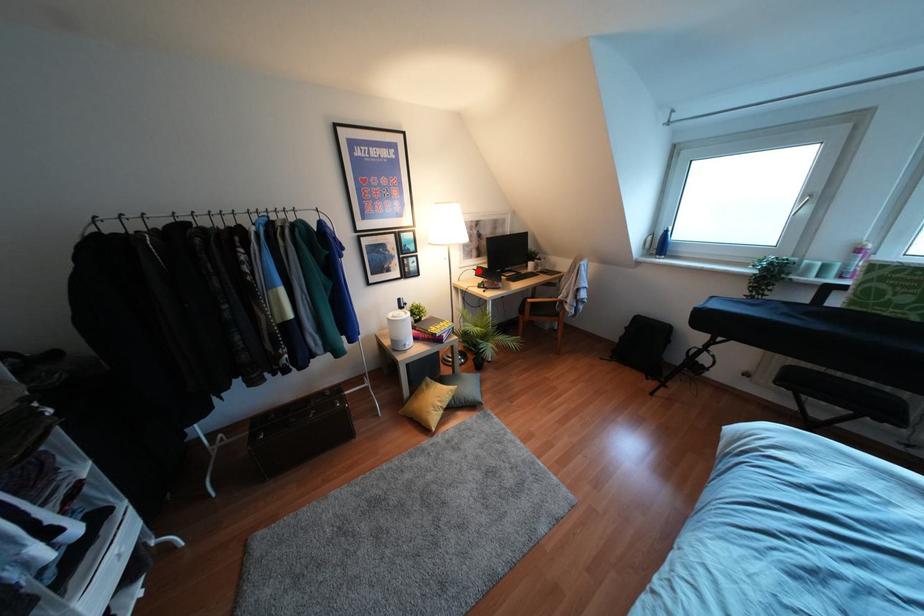
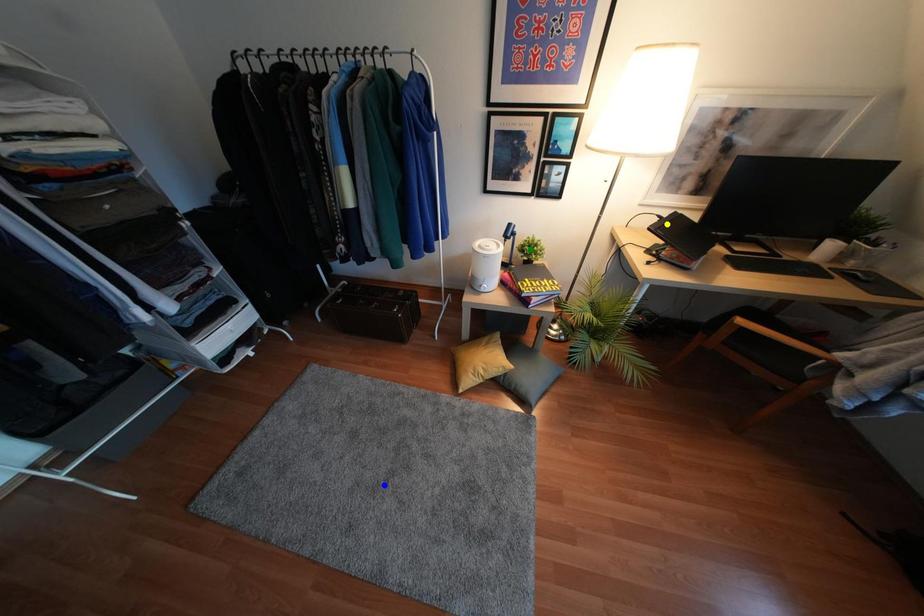
Question: I am providing you with two images of the same scene from different viewpoints. A red point is marked on the first image. You are given multiple points on the second image. Which mark in image 2 goes with the point in image 1?

Choices:
 (A) blue point
 (B) yellow point
 (C) green point

Answer: (B)